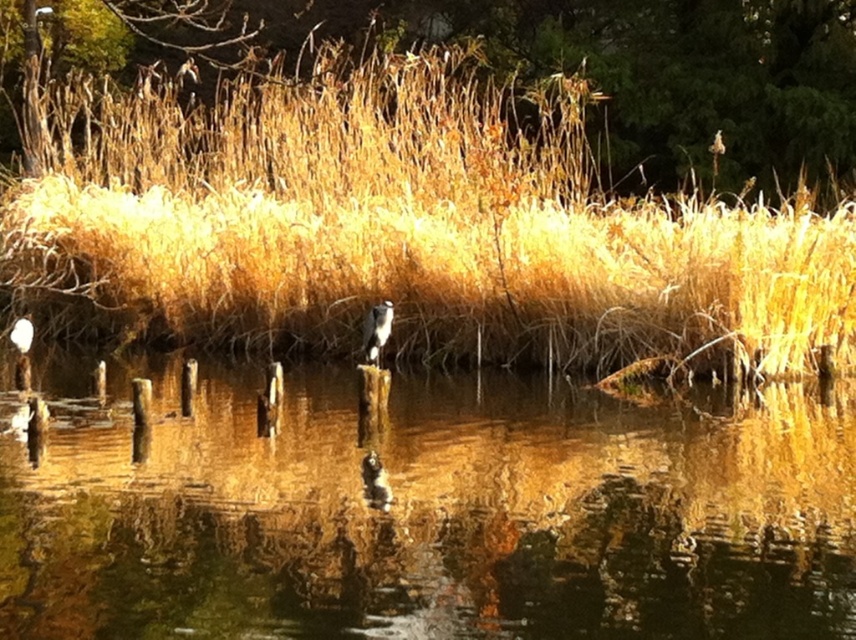
Which is above, brown reflective water at center or white fluffy bird at center?

white fluffy bird at center is higher up.

Which is in front, point (12, 456) or point (382, 316)?

Point (12, 456)

Find the location of a particular element. Image resolution: width=856 pixels, height=640 pixels. brown reflective water at center is located at coordinates (432, 515).

Can you confirm if dry grass at upper center is positioned to the right of brown grass at upper center?

In fact, dry grass at upper center is to the left of brown grass at upper center.

Who is more forward, (92,248) or (526,60)?

Point (92,248)

I want to click on dry grass at upper center, so click(400, 228).

Is point (248, 262) farther from camera compared to point (364, 353)?

Yes, point (248, 262) is farther from viewer.

Does dry grass at upper center appear on the right side of white fluffy bird at center?

In fact, dry grass at upper center is to the left of white fluffy bird at center.

Does point (304, 218) come behind point (372, 344)?

Yes, it is behind point (372, 344).

The height and width of the screenshot is (640, 856). Find the location of `dry grass at upper center`. dry grass at upper center is located at coordinates (400, 228).